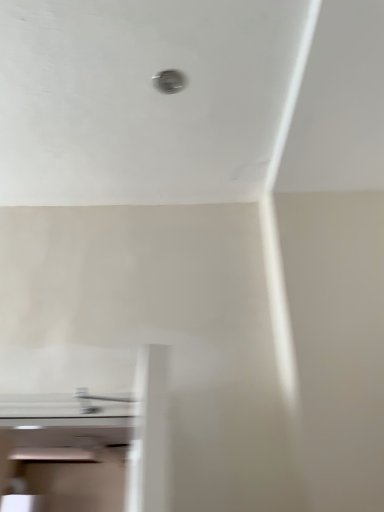
Question: Is satin nickel faucet at lower center taller or shorter than metallic circular hole at upper center?

Choices:
 (A) short
 (B) tall

Answer: (B)

Question: Looking at the image, does satin nickel faucet at lower center seem bigger or smaller compared to metallic circular hole at upper center?

Choices:
 (A) big
 (B) small

Answer: (A)

Question: Is satin nickel faucet at lower center wider or thinner than metallic circular hole at upper center?

Choices:
 (A) wide
 (B) thin

Answer: (A)

Question: From the image's perspective, is metallic circular hole at upper center above or below satin nickel faucet at lower center?

Choices:
 (A) above
 (B) below

Answer: (A)

Question: Looking at the image, does metallic circular hole at upper center seem bigger or smaller compared to satin nickel faucet at lower center?

Choices:
 (A) big
 (B) small

Answer: (B)

Question: Considering the positions of metallic circular hole at upper center and satin nickel faucet at lower center in the image, is metallic circular hole at upper center taller or shorter than satin nickel faucet at lower center?

Choices:
 (A) short
 (B) tall

Answer: (A)

Question: Is metallic circular hole at upper center in front of or behind satin nickel faucet at lower center in the image?

Choices:
 (A) front
 (B) behind

Answer: (B)